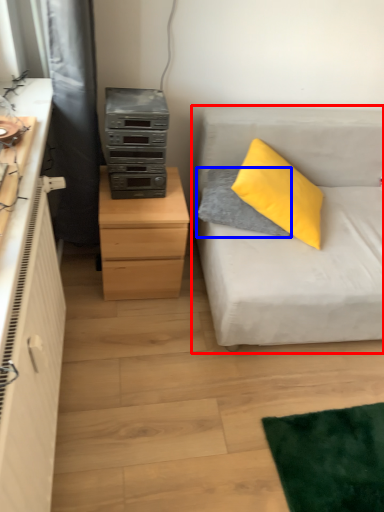
Question: Which object appears closest to the camera in this image, studio couch (highlighted by a red box) or pillow (highlighted by a blue box)?

Choices:
 (A) studio couch
 (B) pillow

Answer: (A)